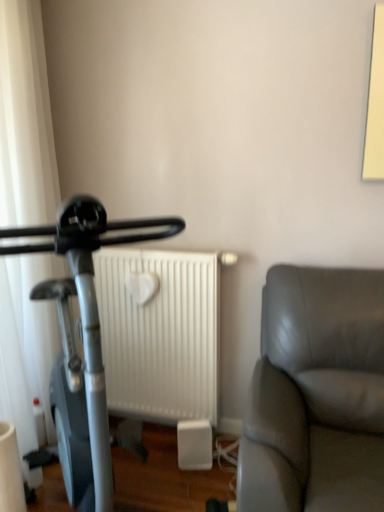
Question: Can you confirm if silver metallic stationary bicycle at left is smaller than white matte radiator at center?

Choices:
 (A) yes
 (B) no

Answer: (B)

Question: Does silver metallic stationary bicycle at left turn towards white matte radiator at center?

Choices:
 (A) no
 (B) yes

Answer: (A)

Question: Is the depth of silver metallic stationary bicycle at left greater than that of white matte radiator at center?

Choices:
 (A) yes
 (B) no

Answer: (B)

Question: Considering the relative sizes of silver metallic stationary bicycle at left and white matte radiator at center in the image provided, is silver metallic stationary bicycle at left wider than white matte radiator at center?

Choices:
 (A) no
 (B) yes

Answer: (B)

Question: Is silver metallic stationary bicycle at left positioned before white matte radiator at center?

Choices:
 (A) yes
 (B) no

Answer: (A)

Question: Do you think silver metallic stationary bicycle at left is within white matte radiator at center, or outside of it?

Choices:
 (A) outside
 (B) inside

Answer: (A)

Question: From a real-world perspective, is silver metallic stationary bicycle at left above or below white matte radiator at center?

Choices:
 (A) above
 (B) below

Answer: (A)

Question: Is silver metallic stationary bicycle at left taller or shorter than white matte radiator at center?

Choices:
 (A) tall
 (B) short

Answer: (A)

Question: Does point (72, 347) appear closer or farther from the camera than point (124, 367)?

Choices:
 (A) closer
 (B) farther

Answer: (A)

Question: From a real-world perspective, relative to white sheer curtain at left, is silver metallic stationary bicycle at left vertically above or below?

Choices:
 (A) below
 (B) above

Answer: (A)

Question: Visually, is silver metallic stationary bicycle at left positioned to the left or to the right of white sheer curtain at left?

Choices:
 (A) left
 (B) right

Answer: (B)

Question: In terms of height, does silver metallic stationary bicycle at left look taller or shorter compared to white sheer curtain at left?

Choices:
 (A) short
 (B) tall

Answer: (A)

Question: Is point (79, 288) closer or farther from the camera than point (29, 410)?

Choices:
 (A) closer
 (B) farther

Answer: (A)

Question: From a real-world perspective, is white sheer curtain at left above or below silver metallic stationary bicycle at left?

Choices:
 (A) below
 (B) above

Answer: (B)

Question: Is point (23, 406) closer or farther from the camera than point (102, 408)?

Choices:
 (A) closer
 (B) farther

Answer: (B)